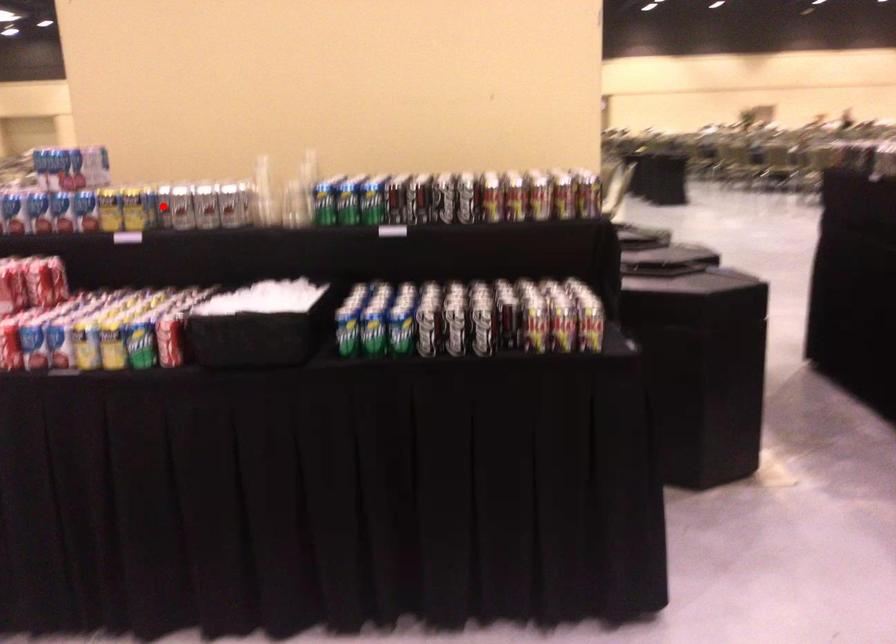
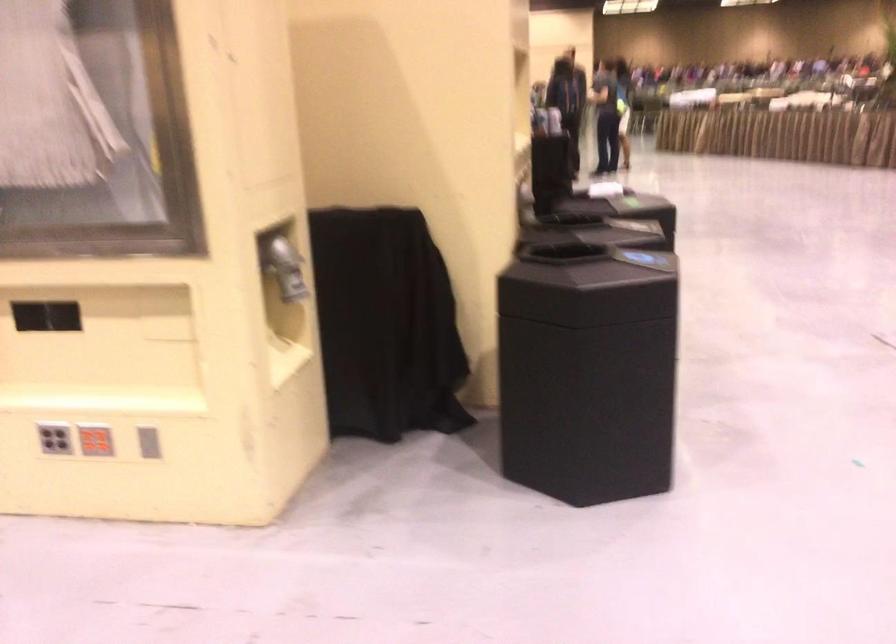
Question: I am providing you with two images of the same scene from different viewpoints. A red point is marked on the first image. Can you still see the location of the red point in image 2?

Choices:
 (A) Yes
 (B) No

Answer: (B)